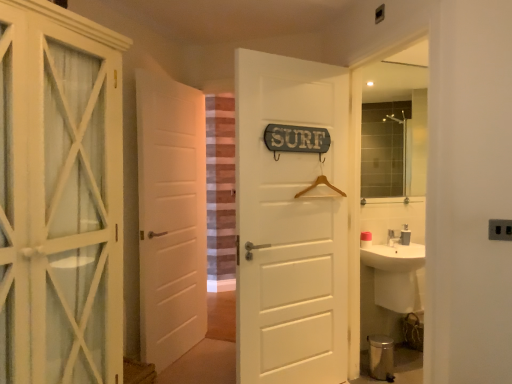
In order to click on white matte door at center, the first door viewed from the back in this screenshot , I will do `click(170, 217)`.

What is the approximate width of white matte door at center, which is counted as the second door, starting from the right?

The width of white matte door at center, which is counted as the second door, starting from the right, is 5.06 inches.

Find the location of a particular element. white wooden cabinet at left, which appears as the third door when viewed from the right is located at coordinates (60, 196).

Does black plastic electric outlet at lower right appear on the right side of white glossy sink at right?

→ No.

Considering the points (502, 230) and (389, 233), which point is behind, point (502, 230) or point (389, 233)?

Point (389, 233)

Is black plastic electric outlet at lower right next to white glossy sink at right?

No.

In the scene shown: From the image's perspective, which object appears higher, black plastic electric outlet at lower right or white glossy sink at right?

black plastic electric outlet at lower right.

Which object is more forward, white glossy sink at right or striped fabric curtain at center?

white glossy sink at right is in front.

Considering the positions of objects white glossy sink at right and striped fabric curtain at center in the image provided, who is more to the right, white glossy sink at right or striped fabric curtain at center?

From the viewer's perspective, white glossy sink at right appears more on the right side.

Based on the photo, from a real-world perspective, who is located lower, white glossy sink at right or striped fabric curtain at center?

white glossy sink at right, from a real-world perspective.

From the image's perspective, which one is positioned higher, white glossy sink at right or striped fabric curtain at center?

striped fabric curtain at center, from the image's perspective.

Which is behind, point (422, 116) or point (40, 122)?

The point (422, 116) is farther.

From a real-world perspective, does matte glass mirror at upper right sit lower than white wooden cabinet at left, the 1th door in the left-to-right sequence?

No, from a real-world perspective, matte glass mirror at upper right is not below white wooden cabinet at left, the 1th door in the left-to-right sequence.

Which is correct: matte glass mirror at upper right is inside white wooden cabinet at left, the 1th door in the left-to-right sequence, or outside of it?

matte glass mirror at upper right is located beyond the bounds of white wooden cabinet at left, the 1th door in the left-to-right sequence.

From the picture: In terms of size, does matte glass mirror at upper right appear bigger or smaller than white wooden cabinet at left, the first door when ordered from front to back?

Considering their sizes, matte glass mirror at upper right takes up less space than white wooden cabinet at left, the first door when ordered from front to back.

In terms of height, does white matte door at center, the 2th door in the left-to-right sequence, look taller or shorter compared to metallic silver toilet bowl at lower right?

Clearly, white matte door at center, the 2th door in the left-to-right sequence, is taller compared to metallic silver toilet bowl at lower right.

Considering the relative sizes of white matte door at center, the first door viewed from the back, and metallic silver toilet bowl at lower right in the image provided, is white matte door at center, the first door viewed from the back, thinner than metallic silver toilet bowl at lower right?

Yes, white matte door at center, the first door viewed from the back, is thinner than metallic silver toilet bowl at lower right.

Can you confirm if white matte door at center, the first door viewed from the back, is positioned to the left of metallic silver toilet bowl at lower right?

Correct, you'll find white matte door at center, the first door viewed from the back, to the left of metallic silver toilet bowl at lower right.

Which of these two, striped fabric curtain at center or matte glass mirror at upper right, is smaller?

matte glass mirror at upper right is smaller.

Is point (226, 182) in front of point (411, 125)?

No.

From a real-world perspective, is striped fabric curtain at center on top of matte glass mirror at upper right?

No, from a real-world perspective, striped fabric curtain at center is not over matte glass mirror at upper right

Is striped fabric curtain at center taller than matte glass mirror at upper right?

Correct, striped fabric curtain at center is much taller as matte glass mirror at upper right.

From the image's perspective, starting from the black plastic electric outlet at lower right, which door is the 3rd one below? Please provide its 2D coordinates.

[(291, 223)]

From a real-world perspective, does white matte door at center, which is the 2th door in back-to-front order, sit lower than black plastic electric outlet at lower right?

Yes, from a real-world perspective, white matte door at center, which is the 2th door in back-to-front order, is beneath black plastic electric outlet at lower right.

How different are the orientations of white matte door at center, which is the 2th door in back-to-front order, and black plastic electric outlet at lower right in degrees?

The angle between the facing direction of white matte door at center, which is the 2th door in back-to-front order, and the facing direction of black plastic electric outlet at lower right is 59.7 degrees.

Between white matte door at center, the first door when ordered from right to left, and black plastic electric outlet at lower right, which one has larger size?

white matte door at center, the first door when ordered from right to left, is bigger.

Which object is thinner, metallic silver toilet bowl at lower right or white wooden cabinet at left, the first door when ordered from front to back?

metallic silver toilet bowl at lower right.

Can you confirm if metallic silver toilet bowl at lower right is positioned to the left of white wooden cabinet at left, which appears as the third door when viewed from the right?

Incorrect, metallic silver toilet bowl at lower right is not on the left side of white wooden cabinet at left, which appears as the third door when viewed from the right.

Choose the correct answer: Is metallic silver toilet bowl at lower right inside white wooden cabinet at left, the 3th door when ordered from back to front, or outside it?

metallic silver toilet bowl at lower right is not enclosed by white wooden cabinet at left, the 3th door when ordered from back to front.

Which is in front, metallic silver toilet bowl at lower right or white wooden cabinet at left, the first door when ordered from front to back?

white wooden cabinet at left, the first door when ordered from front to back, is closer to the camera.

Locate an element on the screen. This screenshot has width=512, height=384. sink located below the black plastic electric outlet at lower right (from the image's perspective) is located at coordinates (397, 274).

The width and height of the screenshot is (512, 384). I want to click on curtain that appears above the white glossy sink at right (from the image's perspective), so click(221, 192).

When comparing their distances from white matte door at center, which is the 2th door in back-to-front order, does black plastic electric outlet at lower right or white glossy sink at right seem further?

black plastic electric outlet at lower right.

Based on their spatial positions, is matte glass mirror at upper right or black plastic electric outlet at lower right closer to white glossy sink at right?

Based on the image, black plastic electric outlet at lower right appears to be nearer to white glossy sink at right.

When comparing their distances from black plastic electric outlet at lower right, does striped fabric curtain at center or matte glass mirror at upper right seem further?

striped fabric curtain at center lies further to black plastic electric outlet at lower right than the other object.

Considering their positions, is striped fabric curtain at center positioned closer to white matte door at center, the first door viewed from the back, than white wooden cabinet at left, the 3th door when ordered from back to front?

white wooden cabinet at left, the 3th door when ordered from back to front, lies closer to white matte door at center, the first door viewed from the back, than the other object.

Based on their spatial positions, is striped fabric curtain at center or white matte door at center, the 2th door in the left-to-right sequence, closer to white glossy sink at right?

white matte door at center, the 2th door in the left-to-right sequence, is closer to white glossy sink at right.

Estimate the real-world distances between objects in this image. Which object is further from white matte door at center, which is the 2th door in back-to-front order, white glossy sink at right or white matte door at center, the 2th door in the left-to-right sequence?

white matte door at center, the 2th door in the left-to-right sequence, lies further to white matte door at center, which is the 2th door in back-to-front order, than the other object.

Consider the image. Based on their spatial positions, is white glossy sink at right or metallic silver toilet bowl at lower right further from white matte door at center, which is the third door from front to back?

metallic silver toilet bowl at lower right is positioned further to the anchor white matte door at center, which is the third door from front to back.

Based on their spatial positions, is white glossy sink at right or black plastic electric outlet at lower right closer to white wooden cabinet at left, which appears as the third door when viewed from the right?

black plastic electric outlet at lower right is positioned closer to the anchor white wooden cabinet at left, which appears as the third door when viewed from the right.

This screenshot has height=384, width=512. In order to click on curtain between matte glass mirror at upper right and metallic silver toilet bowl at lower right in the up-down direction in this screenshot , I will do `click(221, 192)`.

Where is `sink between white wooden cabinet at left, the 3th door when ordered from back to front, and striped fabric curtain at center, along the z-axis`? The height and width of the screenshot is (384, 512). sink between white wooden cabinet at left, the 3th door when ordered from back to front, and striped fabric curtain at center, along the z-axis is located at coordinates (397, 274).

This screenshot has height=384, width=512. In order to click on door between striped fabric curtain at center and matte glass mirror at upper right in the horizontal direction in this screenshot , I will do `click(291, 223)`.

Find the location of a particular element. The height and width of the screenshot is (384, 512). electric outlet situated between white wooden cabinet at left, the 1th door in the left-to-right sequence, and white glossy sink at right from left to right is located at coordinates pyautogui.click(x=500, y=229).